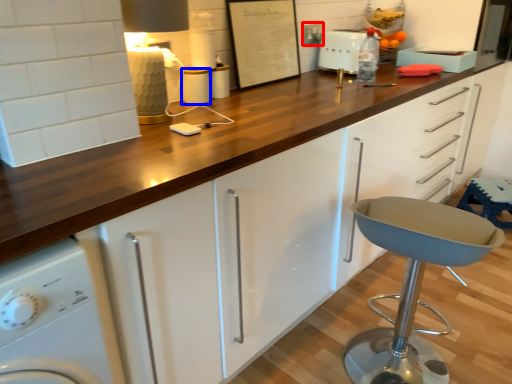
Question: Which of the following is the closest to the observer, electric outlet (highlighted by a red box) or appliance (highlighted by a blue box)?

Choices:
 (A) electric outlet
 (B) appliance

Answer: (B)